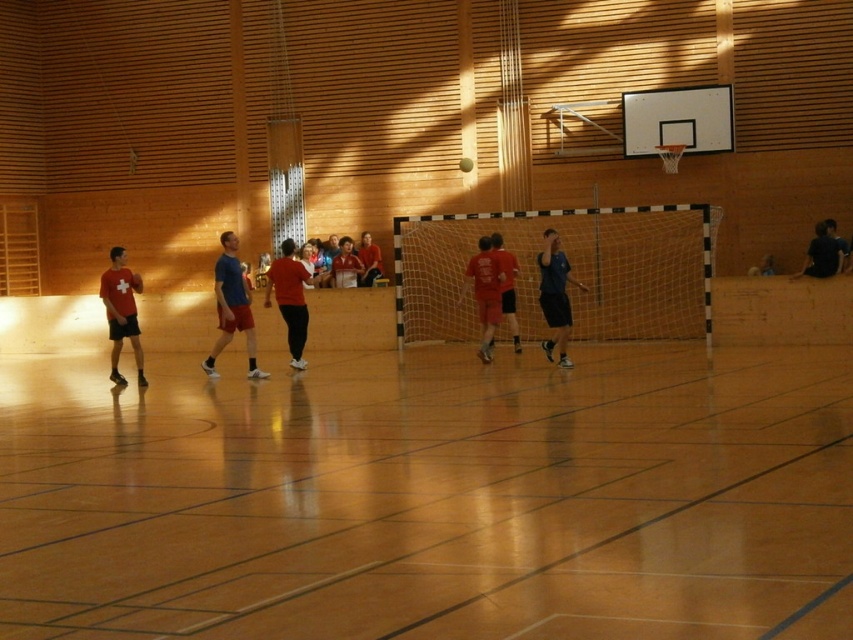
You are a photographer standing in the gymnasium and want to take a photo that includes both the matte red shirt at left and the blue fabric shirt at center. Based on their positions, which shirt should you focus on first to ensure both are in the frame?

The matte red shirt at left is below the blue fabric shirt at center. To include both in the frame, focus on the blue fabric shirt at center first as it is higher up, allowing the camera to capture the lower positioned matte red shirt at left within the same shot.